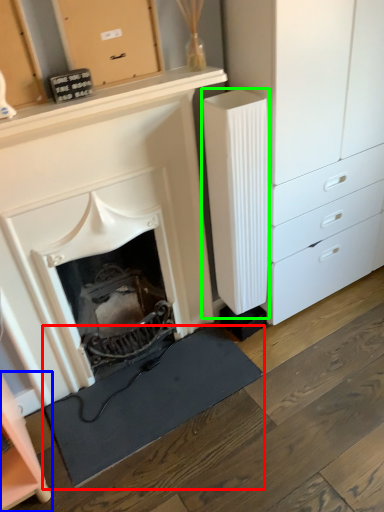
Question: Which object is the farthest from doormat (highlighted by a red box)? Choose among these: cabinetry (highlighted by a blue box) or appliance (highlighted by a green box).

Choices:
 (A) cabinetry
 (B) appliance

Answer: (B)